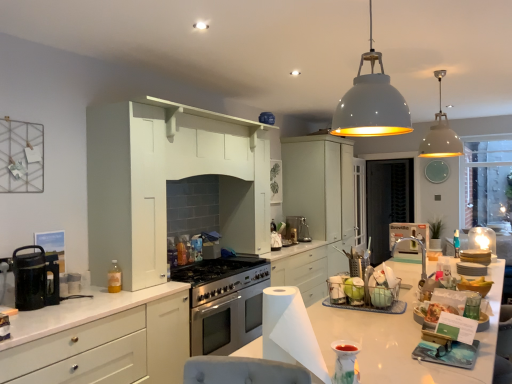
You are a GUI agent. You are given a task and a screenshot of the screen. Output one action in this format:
    pyautogui.click(x=<x>, y=<y>)
    Task: Click on the empty space that is to the right of translucent plastic bottle at left
    The width and height of the screenshot is (512, 384).
    Given the screenshot: What is the action you would take?
    pyautogui.click(x=138, y=283)